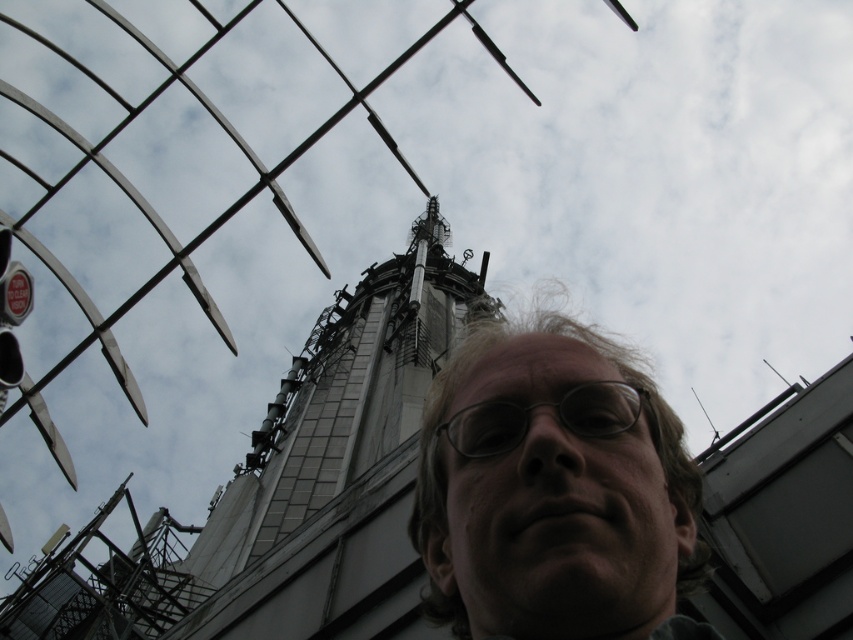
Locate an element on the screen. Image resolution: width=853 pixels, height=640 pixels. light brown hair at center is located at coordinates (554, 490).

Between light brown hair at center and silver metallic tower at center, which one is positioned lower?

light brown hair at center is lower down.

Is point (561, 477) positioned in front of point (283, 403)?

Yes.

Where is `light brown hair at center`? light brown hair at center is located at coordinates (554, 490).

Between silver metallic tower at center and clear plastic glasses at center, which one has more height?

Standing taller between the two is silver metallic tower at center.

Is silver metallic tower at center below clear plastic glasses at center?

Incorrect, silver metallic tower at center is not positioned below clear plastic glasses at center.

Is point (260, 612) less distant than point (433, 448)?

That is False.

At what (x,y) coordinates should I click in order to perform the action: click on silver metallic tower at center. Please return your answer as a coordinate pair (x, y). The image size is (853, 640). Looking at the image, I should click on (338, 461).

Which is more to the right, light brown hair at center or clear plastic glasses at center?

clear plastic glasses at center

Does point (630, 561) come behind point (494, 456)?

No, (630, 561) is in front of (494, 456).

Identify the location of light brown hair at center. (554, 490).